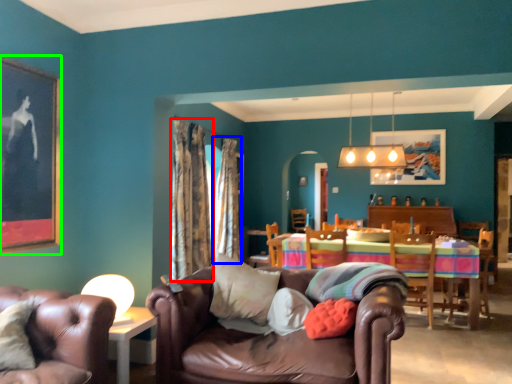
Question: Which object is the farthest from curtain (highlighted by a red box)? Choose among these: curtain (highlighted by a blue box) or picture frame (highlighted by a green box).

Choices:
 (A) curtain
 (B) picture frame

Answer: (B)